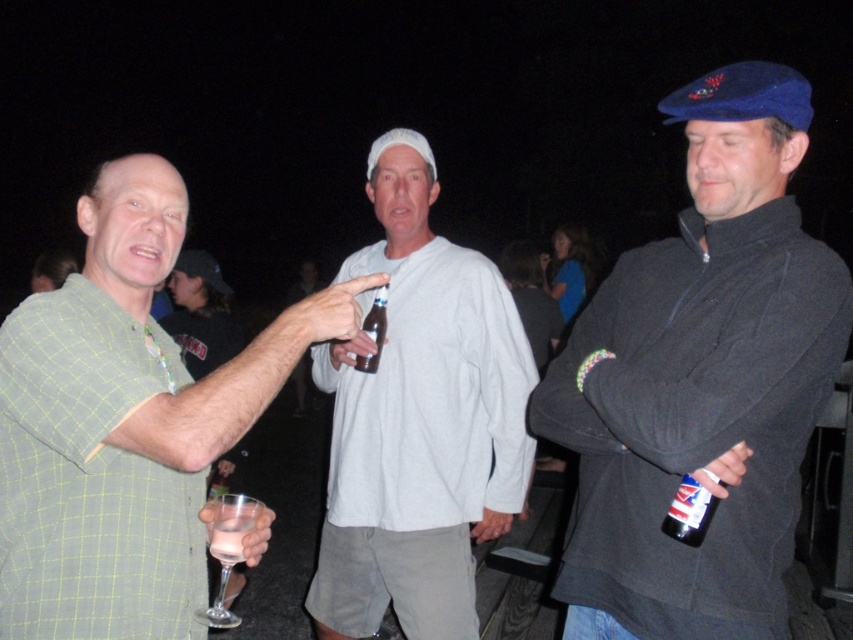
You are trying to pass through the crowd to get to the man in the dark blue fleece jacket at center. Is the green checkered shirt at left blocking your path?

The green checkered shirt at left is behind the dark blue fleece jacket at center, so the green checkered shirt at left is not blocking your path to the dark blue fleece jacket at center.

You are a photographer trying to capture a candid shot of the two men in the scene. You notice the dark blue fleece jacket at center and the green checkered shirt at left. Which man should you focus on first if you want to photograph the taller one?

The dark blue fleece jacket at center is taller than the green checkered shirt at left, so you should focus on the man wearing the dark blue fleece jacket at center first.